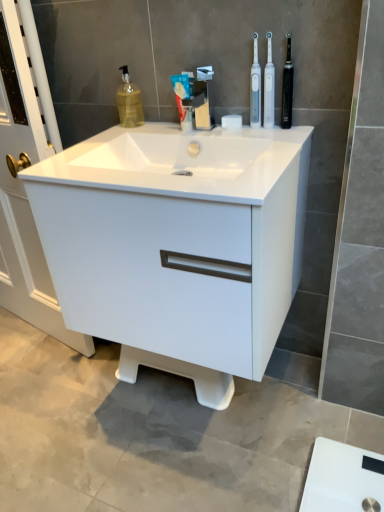
Find the location of a particular element. This screenshot has width=384, height=512. free space that is to the left of white plastic toothbrush at upper right, which is the 2th toothbrush in left-to-right order is located at coordinates (224, 130).